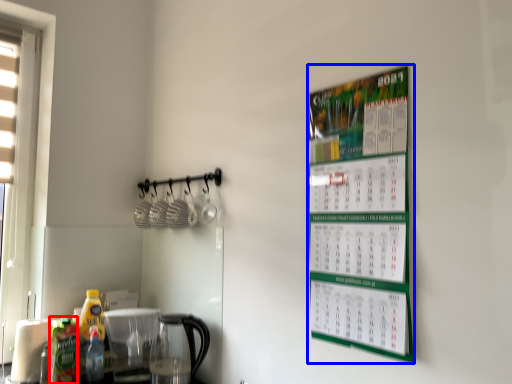
Question: Which object is closer to the camera taking this photo, bottle (highlighted by a red box) or bulletin board (highlighted by a blue box)?

Choices:
 (A) bottle
 (B) bulletin board

Answer: (B)